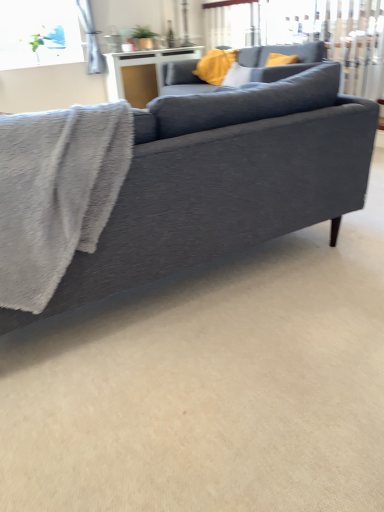
This screenshot has height=512, width=384. What do you see at coordinates (281, 66) in the screenshot? I see `matte gray couch at upper center, which is counted as the 1th studio couch, starting from the top` at bounding box center [281, 66].

Describe the element at coordinates (215, 65) in the screenshot. The height and width of the screenshot is (512, 384). I see `yellow fabric pillow at upper center` at that location.

This screenshot has width=384, height=512. I want to click on yellow fabric pillow at upper center, so (215, 65).

How much space does matte gray couch at center, which is counted as the second studio couch, starting from the back, occupy vertically?

matte gray couch at center, which is counted as the second studio couch, starting from the back, is 84.36 centimeters tall.

The height and width of the screenshot is (512, 384). What are the coordinates of `gray fuzzy bath towel at left` in the screenshot? It's located at (56, 193).

From the image's perspective, which is below, matte gray couch at upper center, the second studio couch in the bottom-to-top sequence, or gray fuzzy bath towel at left?

gray fuzzy bath towel at left, from the image's perspective.

Which point is more distant from viewer, (320, 58) or (59, 208)?

Positioned behind is point (320, 58).

Considering the relative positions of matte gray couch at upper center, which is counted as the 1th studio couch, starting from the top, and gray fuzzy bath towel at left in the image provided, is matte gray couch at upper center, which is counted as the 1th studio couch, starting from the top, to the left of gray fuzzy bath towel at left from the viewer's perspective?

In fact, matte gray couch at upper center, which is counted as the 1th studio couch, starting from the top, is to the right of gray fuzzy bath towel at left.

Between matte gray couch at upper center, which ranks as the 2th studio couch in front-to-back order, and gray fuzzy bath towel at left, which one has smaller width?

gray fuzzy bath towel at left.

From a real-world perspective, is matte gray couch at center, which ranks as the 1th studio couch in front-to-back order, physically located above or below yellow fabric pillow at upper center?

Clearly, from a real-world perspective, matte gray couch at center, which ranks as the 1th studio couch in front-to-back order, is below yellow fabric pillow at upper center.

Is matte gray couch at center, which is counted as the second studio couch, starting from the back, facing towards yellow fabric pillow at upper center?

No, matte gray couch at center, which is counted as the second studio couch, starting from the back, is not facing towards yellow fabric pillow at upper center.

Between matte gray couch at center, which is counted as the second studio couch, starting from the back, and yellow fabric pillow at upper center, which one has larger size?

matte gray couch at center, which is counted as the second studio couch, starting from the back, is bigger.

Which object is closer to the camera taking this photo, matte gray couch at center, arranged as the second studio couch when viewed from the top, or yellow fabric pillow at upper center?

matte gray couch at center, arranged as the second studio couch when viewed from the top.

Is matte gray couch at center, which is counted as the second studio couch, starting from the back, aimed at gray fuzzy bath towel at left?

Yes, matte gray couch at center, which is counted as the second studio couch, starting from the back, is oriented towards gray fuzzy bath towel at left.

How much distance is there between matte gray couch at center, arranged as the second studio couch when viewed from the top, and gray fuzzy bath towel at left?

A distance of 15.71 inches exists between matte gray couch at center, arranged as the second studio couch when viewed from the top, and gray fuzzy bath towel at left.

Which is more to the right, matte gray couch at center, which ranks as the 1th studio couch in bottom-to-top order, or gray fuzzy bath towel at left?

matte gray couch at center, which ranks as the 1th studio couch in bottom-to-top order, is more to the right.

Which is behind, point (53, 310) or point (105, 187)?

Point (53, 310)

Is the surface of white glossy table at upper center in direct contact with matte gray couch at center, arranged as the second studio couch when viewed from the top?

There is a gap between white glossy table at upper center and matte gray couch at center, arranged as the second studio couch when viewed from the top.

Measure the distance between white glossy table at upper center and matte gray couch at center, which ranks as the 1th studio couch in bottom-to-top order.

white glossy table at upper center is 3.61 meters from matte gray couch at center, which ranks as the 1th studio couch in bottom-to-top order.

Considering the relative sizes of white glossy table at upper center and matte gray couch at center, which ranks as the 1th studio couch in bottom-to-top order, in the image provided, is white glossy table at upper center thinner than matte gray couch at center, which ranks as the 1th studio couch in bottom-to-top order,?

Indeed, white glossy table at upper center has a lesser width compared to matte gray couch at center, which ranks as the 1th studio couch in bottom-to-top order.

Is white glossy table at upper center facing towards matte gray couch at center, arranged as the second studio couch when viewed from the top?

Yes.

Can you tell me how much white glossy table at upper center and gray fuzzy bath towel at left differ in facing direction?

The facing directions of white glossy table at upper center and gray fuzzy bath towel at left are 180 degrees apart.

From the image's perspective, which one is positioned higher, white glossy table at upper center or gray fuzzy bath towel at left?

white glossy table at upper center appears higher in the image.

Which is more to the right, white glossy table at upper center or gray fuzzy bath towel at left?

white glossy table at upper center.

Is white glossy table at upper center not near gray fuzzy bath towel at left?

Yes.

Is yellow fabric pillow at upper center far from white glossy table at upper center?

No, yellow fabric pillow at upper center is not far away from white glossy table at upper center.

From the image's perspective, who appears lower, yellow fabric pillow at upper center or white glossy table at upper center?

From the image's view, yellow fabric pillow at upper center is below.

Which is more distant, (226, 70) or (118, 96)?

The point (118, 96) is farther.

From a real-world perspective, is yellow fabric pillow at upper center under white glossy table at upper center?

Incorrect, from a real-world perspective, yellow fabric pillow at upper center is higher than white glossy table at upper center.

Based on the photo, between matte gray couch at upper center, the 1th studio couch viewed from the back, and matte gray couch at center, which is counted as the second studio couch, starting from the back, which one has smaller width?

With smaller width is matte gray couch at upper center, the 1th studio couch viewed from the back.

In terms of height, does matte gray couch at upper center, which is counted as the 1th studio couch, starting from the top, look taller or shorter compared to matte gray couch at center, which ranks as the 1th studio couch in front-to-back order?

Clearly, matte gray couch at upper center, which is counted as the 1th studio couch, starting from the top, is shorter compared to matte gray couch at center, which ranks as the 1th studio couch in front-to-back order.

Does point (306, 69) appear closer or farther from the camera than point (245, 197)?

Clearly, point (306, 69) is more distant from the camera than point (245, 197).

Measure the distance from matte gray couch at upper center, which is counted as the 1th studio couch, starting from the top, to matte gray couch at center, arranged as the second studio couch when viewed from the top.

matte gray couch at upper center, which is counted as the 1th studio couch, starting from the top, is 7.02 feet from matte gray couch at center, arranged as the second studio couch when viewed from the top.

Find the location of a particular element. bath towel below the matte gray couch at upper center, the 1th studio couch viewed from the back (from a real-world perspective) is located at coordinates (56, 193).

Where is `pillow that is on the right side of matte gray couch at center, which ranks as the 1th studio couch in front-to-back order`? pillow that is on the right side of matte gray couch at center, which ranks as the 1th studio couch in front-to-back order is located at coordinates (215, 65).

Looking at the image, which one is located further to yellow fabric pillow at upper center, gray fuzzy bath towel at left or matte gray couch at upper center, the second studio couch in the bottom-to-top sequence?

The object further to yellow fabric pillow at upper center is gray fuzzy bath towel at left.

From the image, which object appears to be nearer to white glossy table at upper center, matte gray couch at center, arranged as the second studio couch when viewed from the top, or yellow fabric pillow at upper center?

Among the two, yellow fabric pillow at upper center is located nearer to white glossy table at upper center.

Considering their positions, is white glossy table at upper center positioned closer to matte gray couch at center, arranged as the second studio couch when viewed from the top, than yellow fabric pillow at upper center?

Based on the image, yellow fabric pillow at upper center appears to be nearer to matte gray couch at center, arranged as the second studio couch when viewed from the top.

Based on their spatial positions, is yellow fabric pillow at upper center or gray fuzzy bath towel at left further from white glossy table at upper center?

The object further to white glossy table at upper center is gray fuzzy bath towel at left.

From the image, which object appears to be farther from white glossy table at upper center, matte gray couch at upper center, which is counted as the 1th studio couch, starting from the top, or matte gray couch at center, arranged as the second studio couch when viewed from the top?

matte gray couch at center, arranged as the second studio couch when viewed from the top, is further to white glossy table at upper center.

Consider the image. Based on their spatial positions, is yellow fabric pillow at upper center or white glossy table at upper center closer to matte gray couch at center, which ranks as the 1th studio couch in bottom-to-top order?

yellow fabric pillow at upper center lies closer to matte gray couch at center, which ranks as the 1th studio couch in bottom-to-top order, than the other object.

Based on their spatial positions, is gray fuzzy bath towel at left or white glossy table at upper center closer to matte gray couch at upper center, which is counted as the 1th studio couch, starting from the top?

Based on the image, white glossy table at upper center appears to be nearer to matte gray couch at upper center, which is counted as the 1th studio couch, starting from the top.

Looking at the image, which one is located further to matte gray couch at upper center, the second studio couch in the bottom-to-top sequence, white glossy table at upper center or yellow fabric pillow at upper center?

Based on the image, white glossy table at upper center appears to be further to matte gray couch at upper center, the second studio couch in the bottom-to-top sequence.

Where is `bath towel located between matte gray couch at center, arranged as the second studio couch when viewed from the top, and matte gray couch at upper center, the 1th studio couch viewed from the back, in the depth direction`? bath towel located between matte gray couch at center, arranged as the second studio couch when viewed from the top, and matte gray couch at upper center, the 1th studio couch viewed from the back, in the depth direction is located at coordinates click(56, 193).

The image size is (384, 512). Identify the location of pillow positioned between matte gray couch at upper center, which is counted as the 1th studio couch, starting from the top, and white glossy table at upper center from near to far. (215, 65).

Find the location of a particular element. The height and width of the screenshot is (512, 384). studio couch located between gray fuzzy bath towel at left and yellow fabric pillow at upper center in the depth direction is located at coordinates (281, 66).

The image size is (384, 512). Find the location of `bath towel positioned between matte gray couch at center, arranged as the second studio couch when viewed from the top, and white glossy table at upper center from near to far`. bath towel positioned between matte gray couch at center, arranged as the second studio couch when viewed from the top, and white glossy table at upper center from near to far is located at coordinates (56, 193).